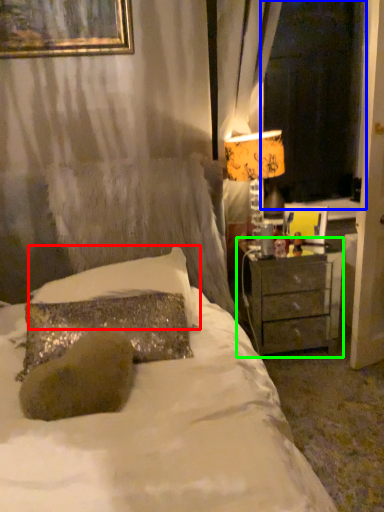
Question: Which object is positioned closest to pillow (highlighted by a red box)? Select from window screen (highlighted by a blue box) and nightstand (highlighted by a green box).

Choices:
 (A) window screen
 (B) nightstand

Answer: (B)